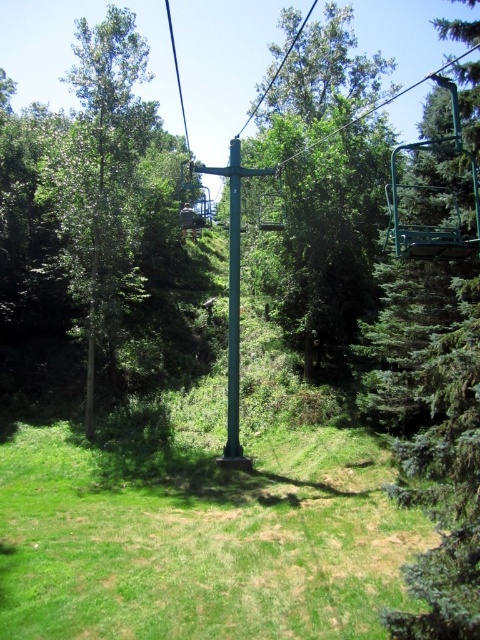
Question: Observing the image, what is the correct spatial positioning of green leafy tree at center in reference to green leafy tree at left?

Choices:
 (A) below
 (B) above

Answer: (A)

Question: Is green leafy tree at center closer to camera compared to green leafy tree at left?

Choices:
 (A) yes
 (B) no

Answer: (A)

Question: Can you confirm if green grassy at center is positioned to the right of green matte pole at center?

Choices:
 (A) no
 (B) yes

Answer: (A)

Question: Based on their relative distances, which object is nearer to the green matte pole at center?

Choices:
 (A) green leafy tree at left
 (B) green grassy at center
 (C) green leafy tree at center

Answer: (B)

Question: Based on their relative distances, which object is farther from the green grassy at center?

Choices:
 (A) green matte pole at center
 (B) green leafy tree at center
 (C) green leafy tree at left

Answer: (B)

Question: Which point is closer to the camera?

Choices:
 (A) green leafy tree at center
 (B) green leafy tree at left
 (C) green matte pole at center
 (D) green grassy at center

Answer: (D)